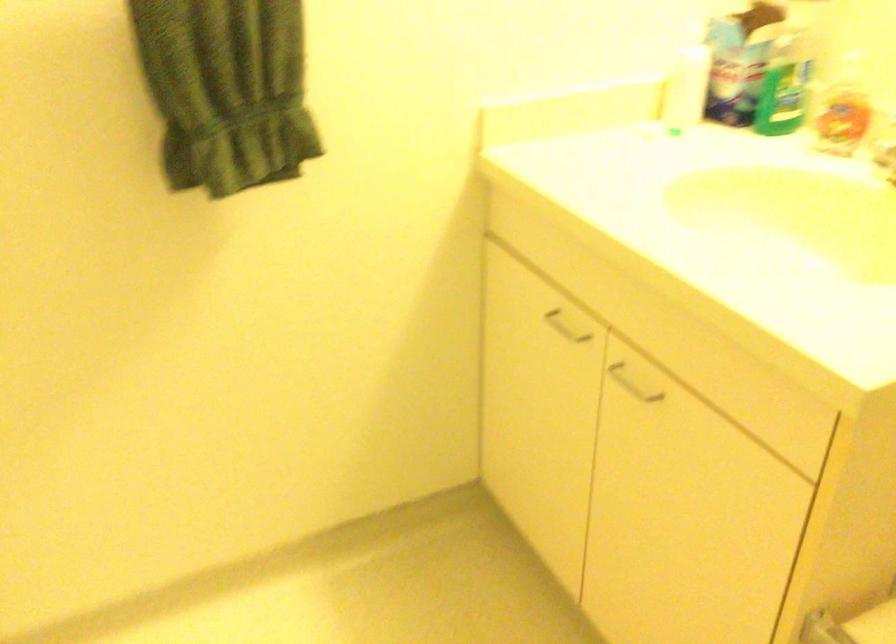
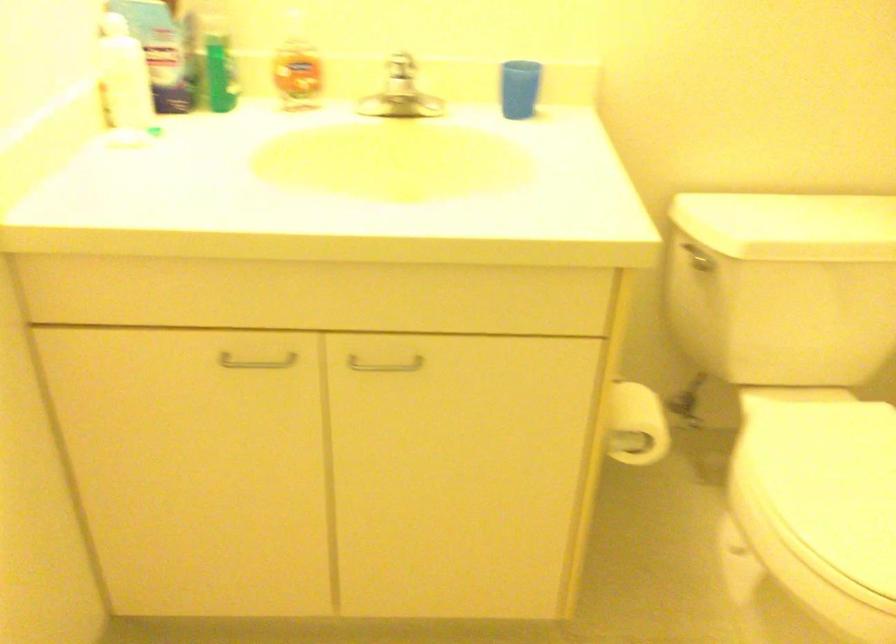
The point at (x=664, y=314) is marked in the first image. Where is the corresponding point in the second image?

(400, 283)